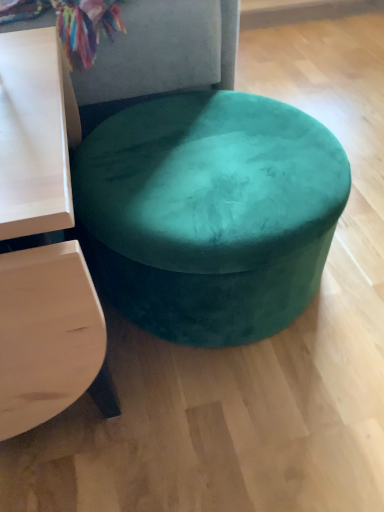
Question: From a real-world perspective, is matte white table at left on teal velvet ottoman at center?

Choices:
 (A) no
 (B) yes

Answer: (B)

Question: Considering the relative sizes of matte white table at left and teal velvet ottoman at center in the image provided, is matte white table at left wider than teal velvet ottoman at center?

Choices:
 (A) no
 (B) yes

Answer: (B)

Question: Does matte white table at left turn towards teal velvet ottoman at center?

Choices:
 (A) yes
 (B) no

Answer: (B)

Question: Is matte white table at left to the right of teal velvet ottoman at center from the viewer's perspective?

Choices:
 (A) no
 (B) yes

Answer: (A)

Question: Is matte white table at left to the left of teal velvet ottoman at center from the viewer's perspective?

Choices:
 (A) no
 (B) yes

Answer: (B)

Question: Does matte white table at left have a smaller size compared to teal velvet ottoman at center?

Choices:
 (A) yes
 (B) no

Answer: (A)

Question: From the image's perspective, does teal velvet ottoman at center appear higher than matte white table at left?

Choices:
 (A) no
 (B) yes

Answer: (B)

Question: Could you tell me if teal velvet ottoman at center is turned towards matte white table at left?

Choices:
 (A) yes
 (B) no

Answer: (B)

Question: Is teal velvet ottoman at center at the right side of matte white table at left?

Choices:
 (A) yes
 (B) no

Answer: (A)

Question: From a real-world perspective, is teal velvet ottoman at center physically below matte white table at left?

Choices:
 (A) no
 (B) yes

Answer: (B)

Question: Is teal velvet ottoman at center wider than matte white table at left?

Choices:
 (A) yes
 (B) no

Answer: (B)

Question: Is teal velvet ottoman at center with matte white table at left?

Choices:
 (A) no
 (B) yes

Answer: (A)

Question: From a real-world perspective, relative to matte white table at left, is teal velvet ottoman at center vertically above or below?

Choices:
 (A) above
 (B) below

Answer: (B)